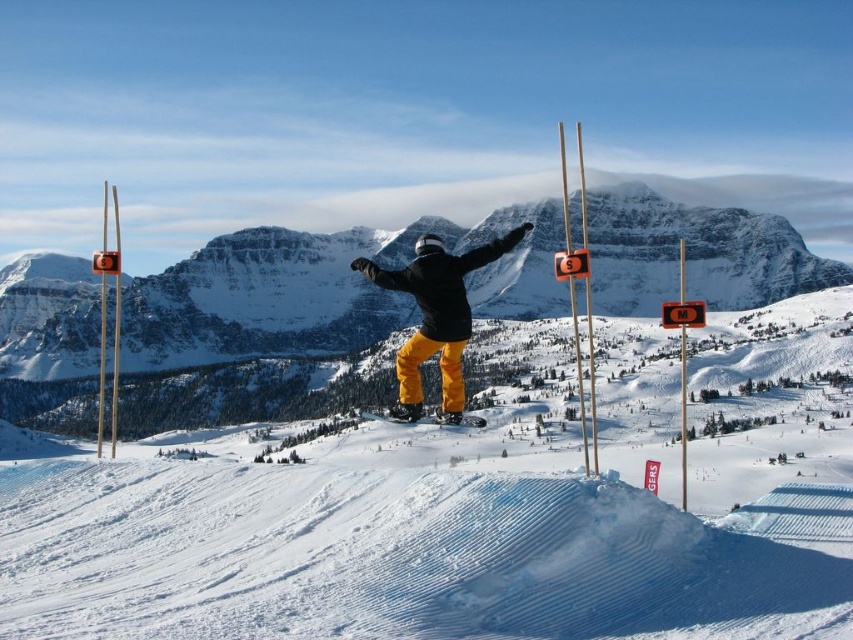
Can you confirm if white powdery snow at center is shorter than matte black snowboarder at center?

Indeed, white powdery snow at center has a lesser height compared to matte black snowboarder at center.

Is white powdery snow at center positioned behind matte black snowboarder at center?

No, white powdery snow at center is in front of matte black snowboarder at center.

The image size is (853, 640). Describe the element at coordinates (447, 528) in the screenshot. I see `white powdery snow at center` at that location.

This screenshot has width=853, height=640. Find the location of `white powdery snow at center`. white powdery snow at center is located at coordinates (447, 528).

Is point (437, 291) behind point (473, 426)?

Yes, it is behind point (473, 426).

Is matte black snowboarder at center bigger than matte yellow snowboard at center?

Indeed, matte black snowboarder at center has a larger size compared to matte yellow snowboard at center.

The width and height of the screenshot is (853, 640). What do you see at coordinates (436, 316) in the screenshot?
I see `matte black snowboarder at center` at bounding box center [436, 316].

I want to click on matte black snowboarder at center, so click(436, 316).

Between white powdery snow at center and matte yellow snowboard at center, which one appears on the right side from the viewer's perspective?

Positioned to the right is white powdery snow at center.

Is point (67, 588) positioned in front of point (479, 424)?

Yes.

Where is `white powdery snow at center`? This screenshot has height=640, width=853. white powdery snow at center is located at coordinates (447, 528).